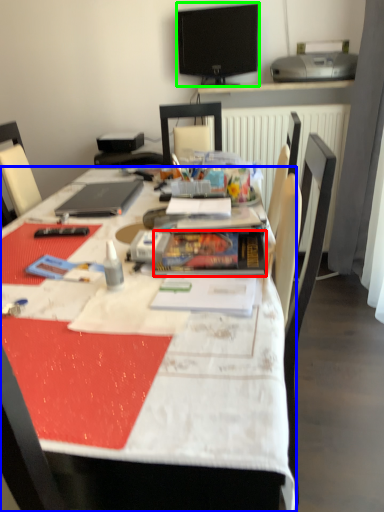
Question: Estimate the real-world distances between objects in this image. Which object is farther from paperback book (highlighted by a red box), desk (highlighted by a blue box) or television (highlighted by a green box)?

Choices:
 (A) desk
 (B) television

Answer: (B)